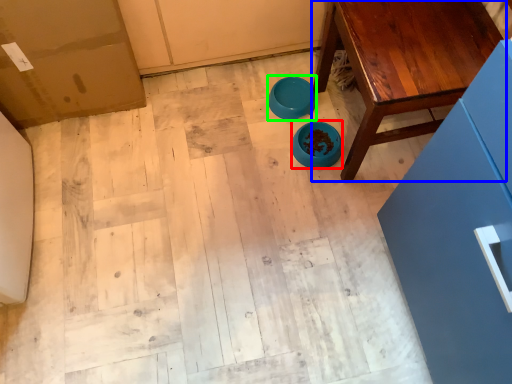
Question: Based on their relative distances, which object is nearer to bowl (highlighted by a red box)? Choose from table (highlighted by a blue box) and bowl (highlighted by a green box).

Choices:
 (A) table
 (B) bowl

Answer: (B)